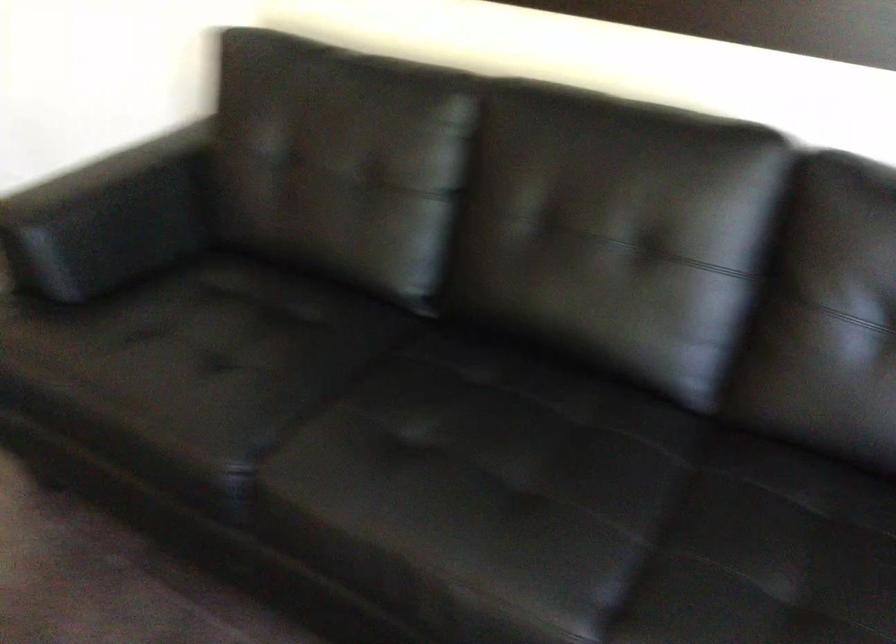
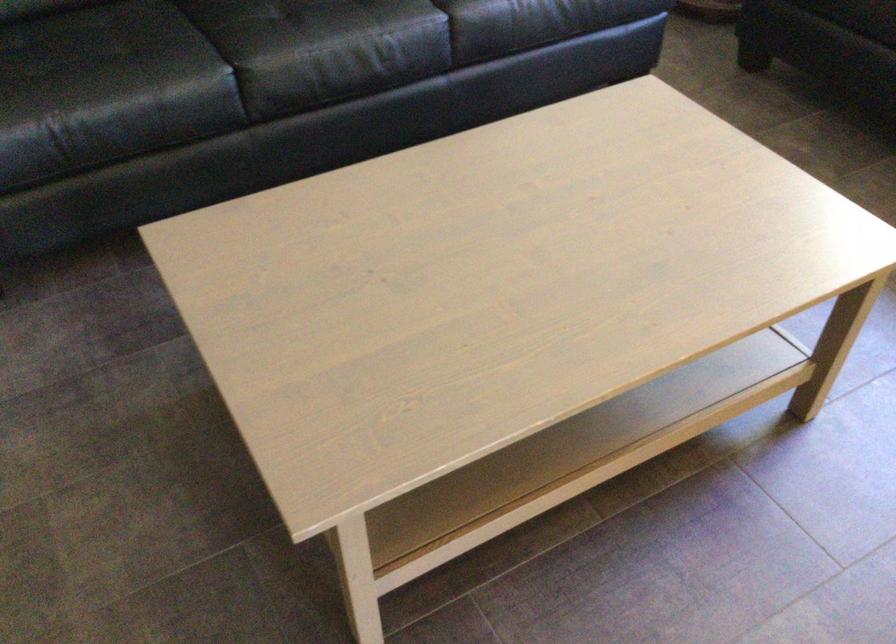
Where in the second image is the point corresponding to (242,460) from the first image?

(221, 78)